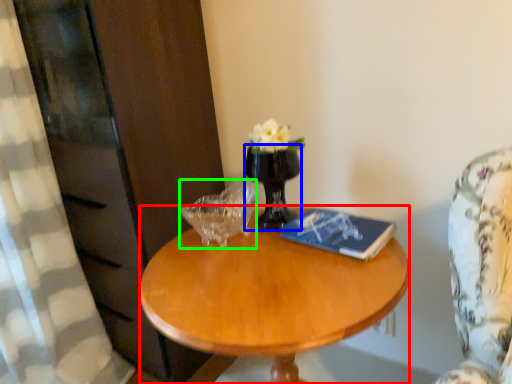
Question: Considering the real-world distances, which object is farthest from coffee table (highlighted by a red box)? vase (highlighted by a blue box) or candle holder (highlighted by a green box)?

Choices:
 (A) vase
 (B) candle holder

Answer: (A)